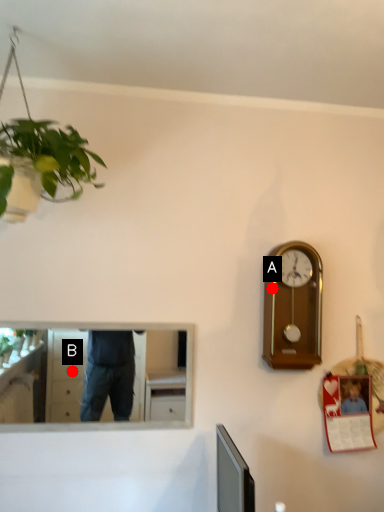
Question: Two points are circled on the image, labeled by A and B beside each circle. Which point appears closest to the camera in this image?

Choices:
 (A) A is closer
 (B) B is closer

Answer: (A)